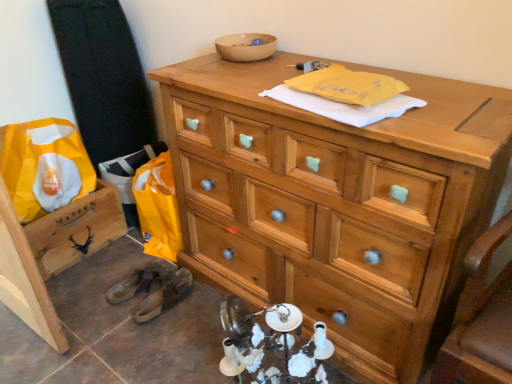
Question: Can you confirm if wooden chest of drawers at upper center is positioned to the right of brown leather shoe at lower left, the 2th shoe when ordered from left to right?

Choices:
 (A) yes
 (B) no

Answer: (A)

Question: Is wooden chest of drawers at upper center in contact with brown leather shoe at lower left, the first shoe when ordered from right to left?

Choices:
 (A) no
 (B) yes

Answer: (A)

Question: From a real-world perspective, is wooden chest of drawers at upper center located beneath brown leather shoe at lower left, the 2th shoe when ordered from left to right?

Choices:
 (A) yes
 (B) no

Answer: (B)

Question: From the image's perspective, is wooden chest of drawers at upper center located beneath brown leather shoe at lower left, the 2th shoe when ordered from left to right?

Choices:
 (A) no
 (B) yes

Answer: (A)

Question: Considering the relative sizes of wooden chest of drawers at upper center and brown leather shoe at lower left, the first shoe when ordered from right to left, in the image provided, is wooden chest of drawers at upper center smaller than brown leather shoe at lower left, the first shoe when ordered from right to left,?

Choices:
 (A) yes
 (B) no

Answer: (B)

Question: Does point (258, 49) appear closer or farther from the camera than point (170, 281)?

Choices:
 (A) closer
 (B) farther

Answer: (A)

Question: From their relative heights in the image, would you say wooden bowl at upper center is taller or shorter than brown leather shoe at lower left, the 2th shoe when ordered from left to right?

Choices:
 (A) short
 (B) tall

Answer: (A)

Question: Is wooden bowl at upper center situated inside brown leather shoe at lower left, the first shoe when ordered from right to left, or outside?

Choices:
 (A) inside
 (B) outside

Answer: (B)

Question: Considering their positions, is wooden bowl at upper center located in front of or behind brown leather shoe at lower left, the 2th shoe when ordered from left to right?

Choices:
 (A) behind
 (B) front

Answer: (B)

Question: From a real-world perspective, is brown leather shoe at lower left, which is the 1th shoe in left-to-right order, positioned above or below wooden chest of drawers at upper center?

Choices:
 (A) above
 (B) below

Answer: (B)

Question: From their relative heights in the image, would you say brown leather shoe at lower left, which is the 1th shoe in left-to-right order, is taller or shorter than wooden chest of drawers at upper center?

Choices:
 (A) tall
 (B) short

Answer: (B)

Question: Does point (134, 271) appear closer or farther from the camera than point (344, 266)?

Choices:
 (A) closer
 (B) farther

Answer: (B)

Question: In the image, is brown leather shoe at lower left, the second shoe in the right-to-left sequence, on the left side or the right side of wooden chest of drawers at upper center?

Choices:
 (A) left
 (B) right

Answer: (A)

Question: From a real-world perspective, relative to brown leather shoe at lower left, the 2th shoe when ordered from left to right, is wooden crate at lower left vertically above or below?

Choices:
 (A) below
 (B) above

Answer: (B)

Question: Is point click(82, 205) positioned closer to the camera than point click(164, 278)?

Choices:
 (A) closer
 (B) farther

Answer: (B)